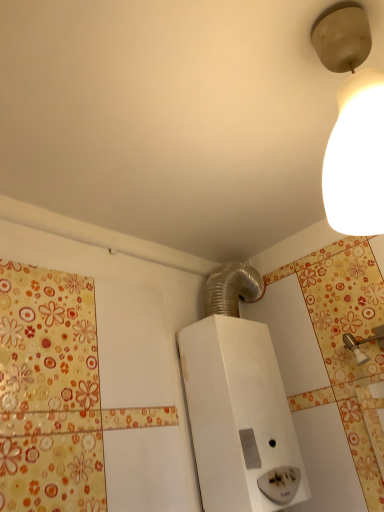
Describe the element at coordinates (239, 416) in the screenshot. The image size is (384, 512). I see `white plastic light switch at center` at that location.

You are a GUI agent. You are given a task and a screenshot of the screen. Output one action in this format:
    pyautogui.click(x=<x>, y=<y>)
    Task: Click on the white plastic light switch at center
    
    Given the screenshot: What is the action you would take?
    tap(239, 416)

The height and width of the screenshot is (512, 384). Find the location of `white plastic light switch at center`. white plastic light switch at center is located at coordinates (239, 416).